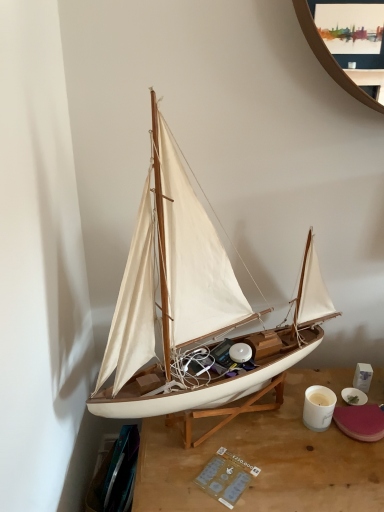
Question: From the image's perspective, is wooden desk at center above white matte sailboat at center?

Choices:
 (A) no
 (B) yes

Answer: (A)

Question: From a real-world perspective, is wooden desk at center under white matte sailboat at center?

Choices:
 (A) no
 (B) yes

Answer: (B)

Question: Would you consider wooden desk at center to be distant from white matte sailboat at center?

Choices:
 (A) yes
 (B) no

Answer: (B)

Question: Does wooden desk at center have a lesser height compared to white matte sailboat at center?

Choices:
 (A) yes
 (B) no

Answer: (A)

Question: Is wooden desk at center at the left side of white matte sailboat at center?

Choices:
 (A) yes
 (B) no

Answer: (B)

Question: Is the position of wooden desk at center more distant than that of white matte sailboat at center?

Choices:
 (A) yes
 (B) no

Answer: (A)

Question: Is white matte sailboat at center facing towards wooden desk at center?

Choices:
 (A) no
 (B) yes

Answer: (A)

Question: Is white matte sailboat at center not within wooden desk at center?

Choices:
 (A) yes
 (B) no

Answer: (A)

Question: Does white matte sailboat at center have a lesser height compared to wooden desk at center?

Choices:
 (A) no
 (B) yes

Answer: (A)

Question: Is white matte sailboat at center bigger than wooden desk at center?

Choices:
 (A) no
 (B) yes

Answer: (B)

Question: From a real-world perspective, is white matte sailboat at center positioned under wooden desk at center based on gravity?

Choices:
 (A) yes
 (B) no

Answer: (B)

Question: Would you say white matte sailboat at center contains wooden desk at center?

Choices:
 (A) no
 (B) yes

Answer: (A)

Question: Does white matte sailboat at center have a greater height compared to white glossy coffee cup at lower right?

Choices:
 (A) no
 (B) yes

Answer: (B)